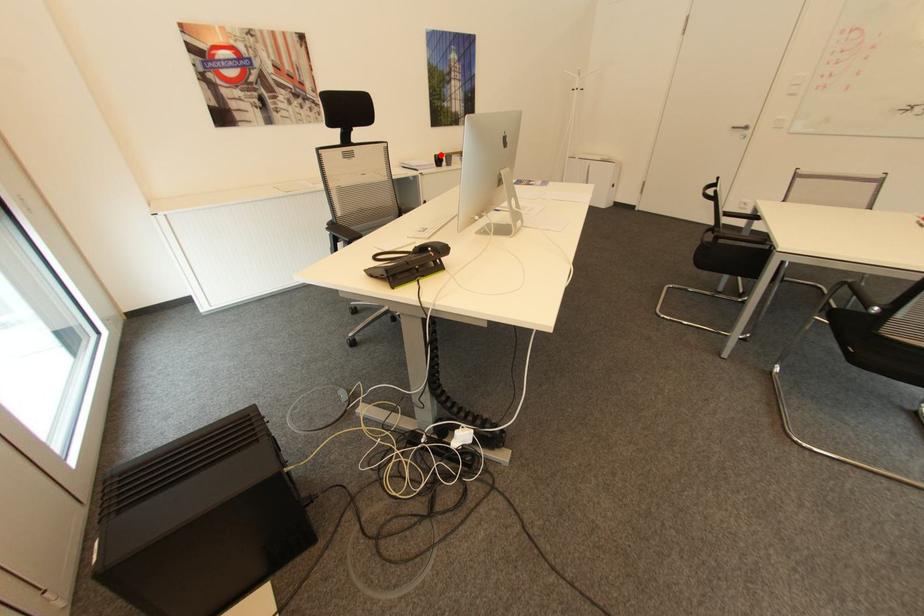
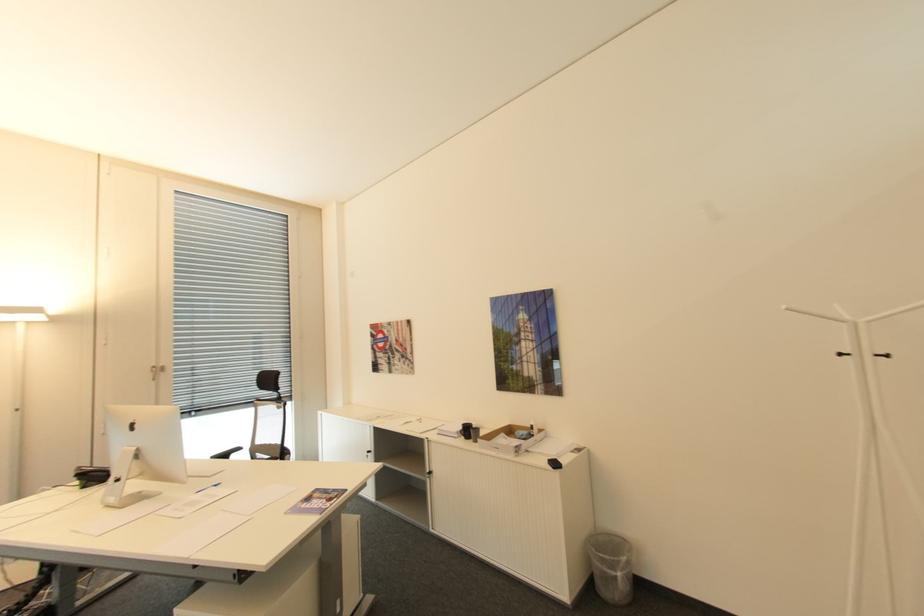
Question: I am providing you with two images of the same scene from different viewpoints. A red point is marked on the first image. Is the red point's position out of view in image 2?

Choices:
 (A) Yes
 (B) No

Answer: (B)